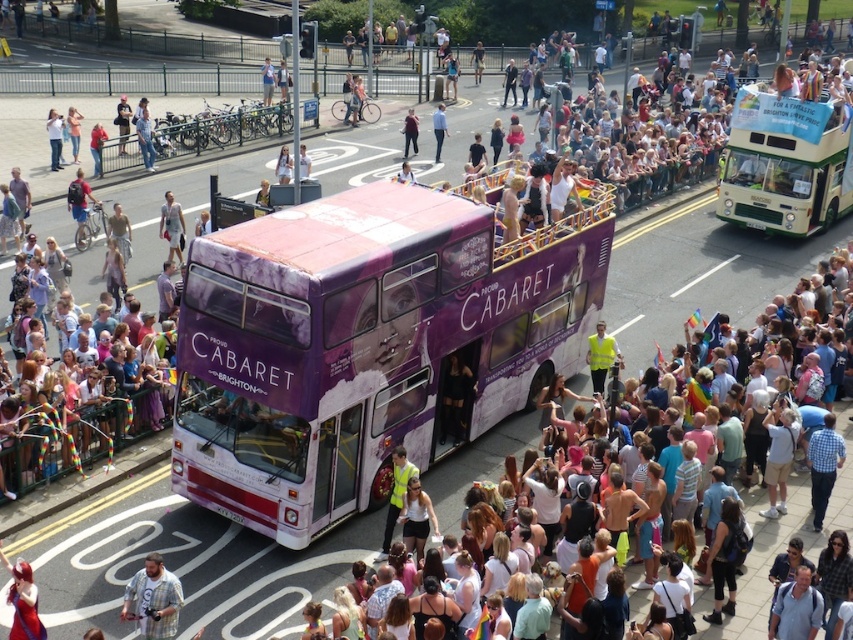
Based on the photo, you are a photographer at the event and want to capture a photo of both the plaid shirt at lower left and the matte purple bus at center. Which object is shorter and should be positioned closer to the bottom of the frame?

The plaid shirt at lower left is not as tall as the matte purple bus at center, so it should be positioned closer to the bottom of the frame.

You are standing at the center of the image and want to find the plaid shirt at lower left. In which direction should you look to see it?

The plaid shirt at lower left is located at point (154,600), so you should look to the lower left direction from the center of the image to see it.

You are standing on the sidewalk at the event, and you want to take a photo of the purple matte bus at center. If your camera can focus on objects up to 15 meters away, will you need to move closer to get a clear shot?

The purple matte bus at center is 15.85 meters away from viewer, which is beyond the camera focus range of 15 meters. You need to move closer to ensure the camera can focus properly.